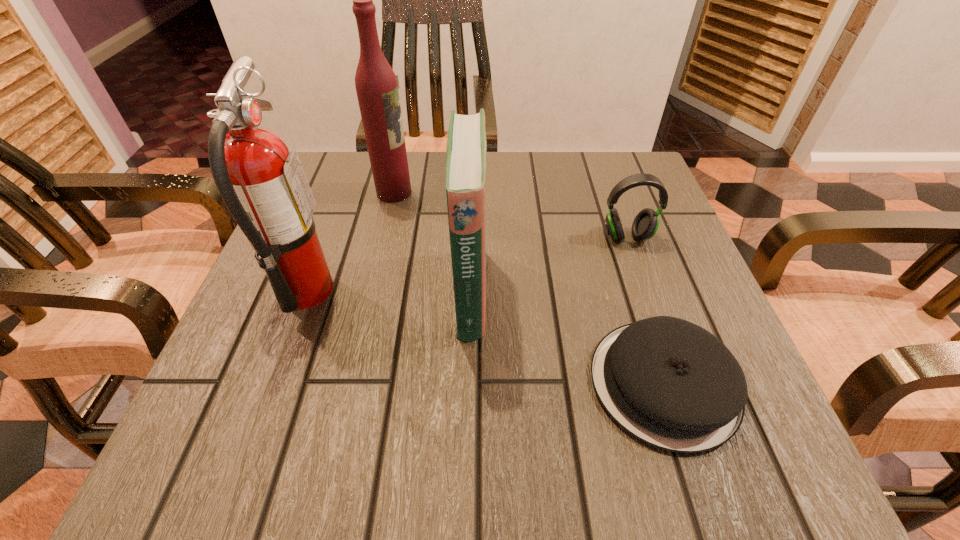
What are the coordinates of `free location that satisfies the following two spatial constraints: 1. on the ear cups of the fourth tallest object; 2. on the cover of the third object from right to left` in the screenshot? It's located at (646, 292).

Where is `vacant space that satisfies the following two spatial constraints: 1. on the ear cups of the fourth nearest object; 2. on the cover of the third tallest object`? The image size is (960, 540). vacant space that satisfies the following two spatial constraints: 1. on the ear cups of the fourth nearest object; 2. on the cover of the third tallest object is located at coordinates (646, 292).

Identify the location of vacant area that satisfies the following two spatial constraints: 1. on the label of the pancake; 2. on the left side of the farthest object. This screenshot has width=960, height=540. (350, 383).